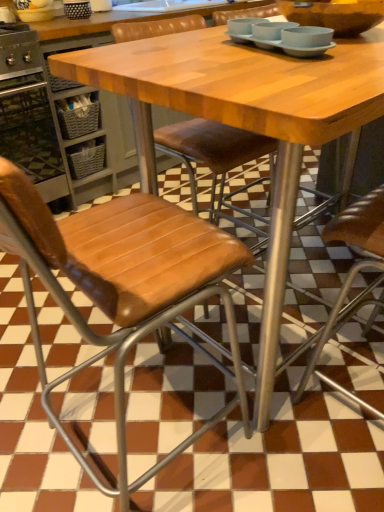
Question: From a real-world perspective, is light blue matte bowls at upper center located higher than wooden table at center?

Choices:
 (A) no
 (B) yes

Answer: (B)

Question: Is wooden table at center a part of light blue matte bowls at upper center?

Choices:
 (A) yes
 (B) no

Answer: (B)

Question: Is light blue matte bowls at upper center outside wooden table at center?

Choices:
 (A) yes
 (B) no

Answer: (A)

Question: From the image's perspective, is light blue matte bowls at upper center on wooden table at center?

Choices:
 (A) no
 (B) yes

Answer: (B)

Question: Does light blue matte bowls at upper center turn towards wooden table at center?

Choices:
 (A) no
 (B) yes

Answer: (A)

Question: Is matte brown bowl at upper center bigger or smaller than wooden table at center?

Choices:
 (A) small
 (B) big

Answer: (A)

Question: Is matte brown bowl at upper center taller or shorter than wooden table at center?

Choices:
 (A) short
 (B) tall

Answer: (A)

Question: Choose the correct answer: Is matte brown bowl at upper center inside wooden table at center or outside it?

Choices:
 (A) inside
 (B) outside

Answer: (B)

Question: Is point (337, 33) closer or farther from the camera than point (347, 99)?

Choices:
 (A) closer
 (B) farther

Answer: (B)

Question: From the image's perspective, is brown leather chair at center, the 1th chair when ordered from right to left, above or below brown leather chair at center, placed as the 1th chair when sorted from left to right?

Choices:
 (A) above
 (B) below

Answer: (B)

Question: Visually, is brown leather chair at center, which ranks as the 2th chair in left-to-right order, positioned to the left or to the right of brown leather chair at center, which is the 2th chair from right to left?

Choices:
 (A) right
 (B) left

Answer: (A)

Question: Looking at their shapes, would you say brown leather chair at center, the 1th chair when ordered from right to left, is wider or thinner than brown leather chair at center, which is the 2th chair from right to left?

Choices:
 (A) thin
 (B) wide

Answer: (B)

Question: Is point (195, 271) closer or farther from the camera than point (188, 159)?

Choices:
 (A) closer
 (B) farther

Answer: (A)

Question: In the image, is brushed metal oven at left positioned in front of or behind brown leather chair at center, which ranks as the 2th chair in left-to-right order?

Choices:
 (A) behind
 (B) front

Answer: (A)

Question: From the image's perspective, is brushed metal oven at left located above or below brown leather chair at center, the 1th chair when ordered from right to left?

Choices:
 (A) above
 (B) below

Answer: (A)